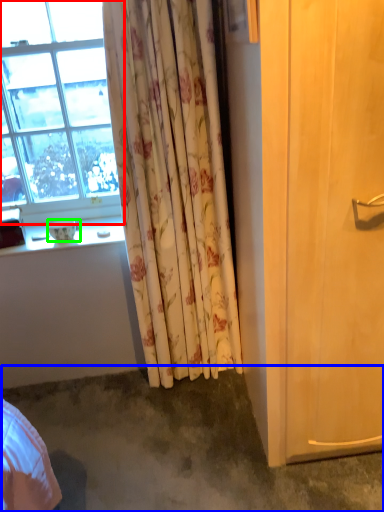
Question: Based on their relative distances, which object is nearer to window (highlighted by a red box)? Choose from concrete (highlighted by a blue box) and bowl (highlighted by a green box).

Choices:
 (A) concrete
 (B) bowl

Answer: (B)